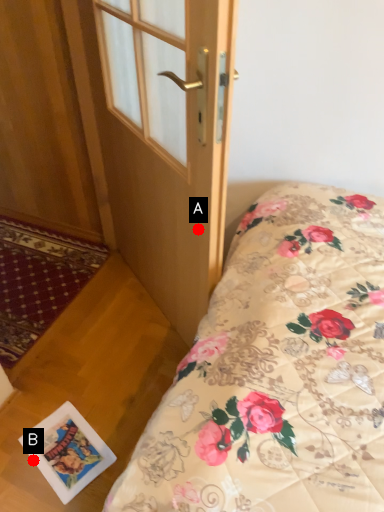
Question: Two points are circled on the image, labeled by A and B beside each circle. Which point is further to the camera?

Choices:
 (A) A is further
 (B) B is further

Answer: (B)